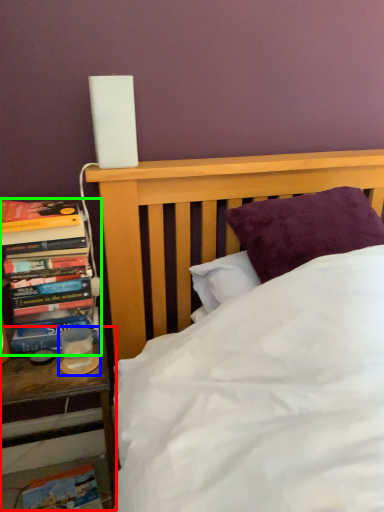
Question: Based on their relative distances, which object is nearer to nightstand (highlighted by a red box)? Choose from candle holder (highlighted by a blue box) and book (highlighted by a green box).

Choices:
 (A) candle holder
 (B) book

Answer: (A)